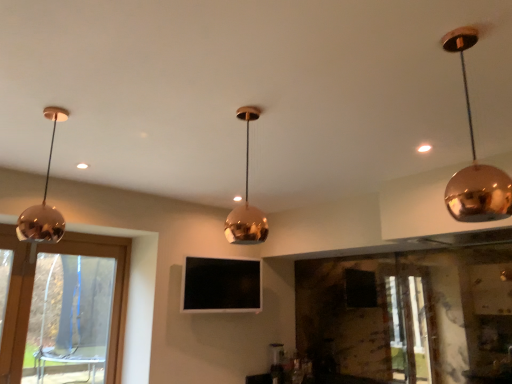
Describe the element at coordinates (63, 309) in the screenshot. This screenshot has height=384, width=512. I see `transparent glass window at left` at that location.

Measure the distance between point (52, 213) and camera.

Point (52, 213) is 1.66 meters away from camera.

Measure the distance between shiny copper pendant light at upper right, acting as the third lamp starting from the left, and camera.

The distance of shiny copper pendant light at upper right, acting as the third lamp starting from the left, from camera is 3.53 feet.

The image size is (512, 384). Describe the element at coordinates (221, 285) in the screenshot. I see `matte black tv at center` at that location.

This screenshot has height=384, width=512. Identify the location of transparent glass window at left. coord(63,309).

From the image's perspective, would you say matte black tv at center is shown under shiny copper pendant light at left, acting as the first lamp starting from the left?

Yes, from the image's perspective, matte black tv at center is below shiny copper pendant light at left, acting as the first lamp starting from the left.

Is matte black tv at center not near shiny copper pendant light at left, acting as the first lamp starting from the left?

Absolutely, matte black tv at center is distant from shiny copper pendant light at left, acting as the first lamp starting from the left.

Which is in front, point (202, 260) or point (52, 138)?

Positioned in front is point (52, 138).

Considering their positions, is matte black tv at center located in front of or behind shiny copper pendant light at left, acting as the first lamp starting from the left?

matte black tv at center is positioned farther from the viewer than shiny copper pendant light at left, acting as the first lamp starting from the left.

Which is in front, matte white light at upper right or polished copper pendant light at center, which is counted as the second lamp, starting from the right?

polished copper pendant light at center, which is counted as the second lamp, starting from the right, is closer to the camera.

Can you confirm if matte white light at upper right is positioned to the left of polished copper pendant light at center, the second lamp when ordered from left to right?

No.

From a real-world perspective, is matte white light at upper right physically above polished copper pendant light at center, the second lamp when ordered from left to right?

Yes.

Which is less distant, (430, 146) or (259, 110)?

Point (430, 146) is positioned farther from the camera compared to point (259, 110).

Consider the image. Is matte white light at upper right beside transparent glass window at left?

No.

Does matte white light at upper right have a smaller size compared to transparent glass window at left?

Correct, matte white light at upper right occupies less space than transparent glass window at left.

Image resolution: width=512 pixels, height=384 pixels. Identify the location of window below the matte white light at upper right (from the image's perspective). (63, 309).

How far apart are transparent glass window at left and polished copper pendant light at center, the second lamp when ordered from left to right?

transparent glass window at left and polished copper pendant light at center, the second lamp when ordered from left to right, are 2.21 meters apart.

This screenshot has width=512, height=384. I want to click on the 1st lamp located above the transparent glass window at left (from a real-world perspective), so click(x=246, y=199).

Which object is wider, transparent glass window at left or polished copper pendant light at center, the second lamp when ordered from left to right?

polished copper pendant light at center, the second lamp when ordered from left to right, is wider.

Looking at this image, is the depth of transparent glass window at left greater than that of polished copper pendant light at center, which is counted as the second lamp, starting from the right?

Yes, it is.

Is matte black tv at center not close to polished copper pendant light at center, which is counted as the second lamp, starting from the right?

Yes.

Consider the image. Is matte black tv at center situated inside polished copper pendant light at center, which is counted as the second lamp, starting from the right, or outside?

matte black tv at center is outside polished copper pendant light at center, which is counted as the second lamp, starting from the right.

Which object is further away from the camera, shiny copper pendant light at upper right, placed as the 1th lamp when sorted from right to left, or matte black tv at center?

matte black tv at center is behind.

Is shiny copper pendant light at upper right, acting as the third lamp starting from the left, positioned far away from matte black tv at center?

Yes, shiny copper pendant light at upper right, acting as the third lamp starting from the left, and matte black tv at center are quite far apart.

Considering the points (498, 193) and (195, 275), which point is in front, point (498, 193) or point (195, 275)?

The point (498, 193) is closer.

Does shiny copper pendant light at upper right, acting as the third lamp starting from the left, appear on the right side of matte black tv at center?

Yes, shiny copper pendant light at upper right, acting as the third lamp starting from the left, is to the right of matte black tv at center.

From the image's perspective, between shiny copper pendant light at upper right, acting as the third lamp starting from the left, and matte white light at upper right, which one is located above?

matte white light at upper right, from the image's perspective.

Is shiny copper pendant light at upper right, acting as the third lamp starting from the left, in front of or behind matte white light at upper right in the image?

Clearly, shiny copper pendant light at upper right, acting as the third lamp starting from the left, is in front of matte white light at upper right.

Is matte white light at upper right at the back of shiny copper pendant light at upper right, acting as the third lamp starting from the left?

No, shiny copper pendant light at upper right, acting as the third lamp starting from the left, is not facing the opposite direction of matte white light at upper right.

Considering the positions of point (466, 47) and point (419, 151), is point (466, 47) closer or farther from the camera than point (419, 151)?

Point (466, 47) is closer to the camera than point (419, 151).

You are a GUI agent. You are given a task and a screenshot of the screen. Output one action in this format:
    pyautogui.click(x=<x>, y=<y>)
    Task: Click on the television located below the shiny copper pendant light at left, acting as the first lamp starting from the left (from the image's perspective)
    This screenshot has height=384, width=512.
    Given the screenshot: What is the action you would take?
    pyautogui.click(x=221, y=285)

From the matte white light at upper right, count the 2nd lamp to the left and point to it. Please provide its 2D coordinates.

[(246, 199)]

From the image, which object appears to be nearer to matte white light at upper right, transparent glass window at left or shiny copper pendant light at upper right, placed as the 1th lamp when sorted from right to left?

The object closer to matte white light at upper right is shiny copper pendant light at upper right, placed as the 1th lamp when sorted from right to left.

Considering their positions, is shiny copper pendant light at left, acting as the first lamp starting from the left, positioned further to matte black tv at center than transparent glass window at left?

The object further to matte black tv at center is shiny copper pendant light at left, acting as the first lamp starting from the left.

When comparing their distances from matte white light at upper right, does polished copper pendant light at center, which is counted as the second lamp, starting from the right, or transparent glass window at left seem closer?

The object closer to matte white light at upper right is polished copper pendant light at center, which is counted as the second lamp, starting from the right.

Looking at the image, which one is located further to shiny copper pendant light at left, acting as the first lamp starting from the left, shiny copper pendant light at upper right, placed as the 1th lamp when sorted from right to left, or transparent glass window at left?

transparent glass window at left.

Looking at the image, which one is located closer to transparent glass window at left, polished copper pendant light at center, the second lamp when ordered from left to right, or shiny copper pendant light at left, acting as the first lamp starting from the left?

shiny copper pendant light at left, acting as the first lamp starting from the left.

Considering their positions, is shiny copper pendant light at upper right, placed as the 1th lamp when sorted from right to left, positioned further to shiny copper pendant light at left, positioned as the third lamp in right-to-left order, than matte white light at upper right?

matte white light at upper right lies further to shiny copper pendant light at left, positioned as the third lamp in right-to-left order, than the other object.

Estimate the real-world distances between objects in this image. Which object is closer to matte black tv at center, shiny copper pendant light at upper right, acting as the third lamp starting from the left, or matte white light at upper right?

matte white light at upper right is closer to matte black tv at center.

Considering their positions, is matte black tv at center positioned closer to shiny copper pendant light at upper right, acting as the third lamp starting from the left, than matte white light at upper right?

Among the two, matte white light at upper right is located nearer to shiny copper pendant light at upper right, acting as the third lamp starting from the left.

Image resolution: width=512 pixels, height=384 pixels. What are the coordinates of `lamp between polished copper pendant light at center, which is counted as the second lamp, starting from the right, and transparent glass window at left, along the z-axis` in the screenshot? It's located at (42, 202).

Identify the location of window positioned between shiny copper pendant light at upper right, placed as the 1th lamp when sorted from right to left, and matte black tv at center from near to far. (63, 309).

The width and height of the screenshot is (512, 384). Find the location of `glow between polished copper pendant light at center, the second lamp when ordered from left to right, and matte black tv at center from front to back`. glow between polished copper pendant light at center, the second lamp when ordered from left to right, and matte black tv at center from front to back is located at coordinates (424, 148).

Identify the location of television between transparent glass window at left and matte white light at upper right from left to right. This screenshot has height=384, width=512. (221, 285).